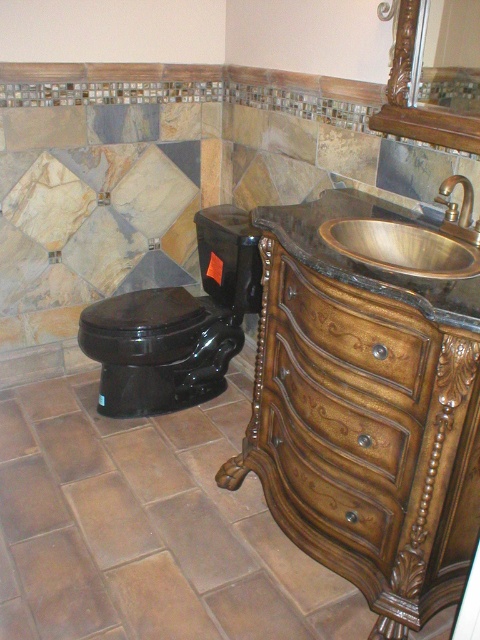
Question: Does wooden drawer at center appear over glossy wood mirror at upper right?

Choices:
 (A) yes
 (B) no

Answer: (B)

Question: Estimate the real-world distances between objects in this image. Which object is farther from the black glossy toilet at center?

Choices:
 (A) brown wood dresser at lower right
 (B) wooden frame at upper right
 (C) wooden drawer at center

Answer: (B)

Question: Does brass metallic sink at right appear over wooden frame at upper right?

Choices:
 (A) yes
 (B) no

Answer: (B)

Question: Which point is closer to the camera taking this photo?

Choices:
 (A) (376, 250)
 (B) (107, 317)
 (C) (417, 116)

Answer: (A)

Question: Does black glossy toilet at center lie in front of wooden frame at upper right?

Choices:
 (A) no
 (B) yes

Answer: (A)

Question: Which point is closer to the camera?

Choices:
 (A) (408, 40)
 (B) (190, 401)
 (C) (337, 221)
 (D) (268, 355)

Answer: (C)